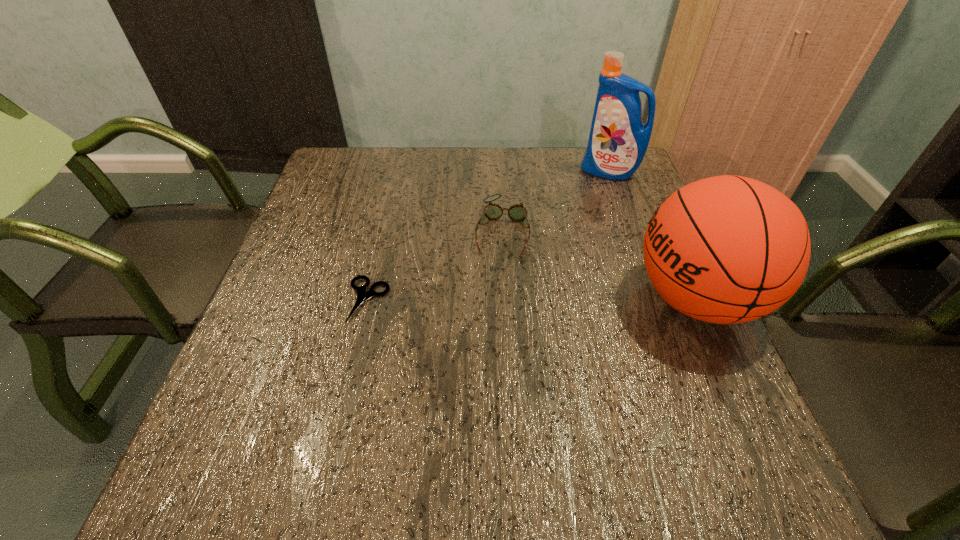
Identify the location of vacant area that satisfies the following two spatial constraints: 1. on the front side of the farthest object; 2. on the side with logo of the basketball. (656, 299).

Identify the location of blank area in the image that satisfies the following two spatial constraints: 1. on the back side of the detergent; 2. on the right side of the shears. The width and height of the screenshot is (960, 540). (397, 172).